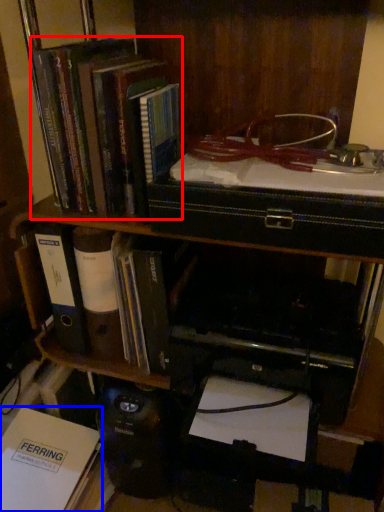
Question: Which of the following is the closest to the observer, book (highlighted by a red box) or book (highlighted by a blue box)?

Choices:
 (A) book
 (B) book

Answer: (A)